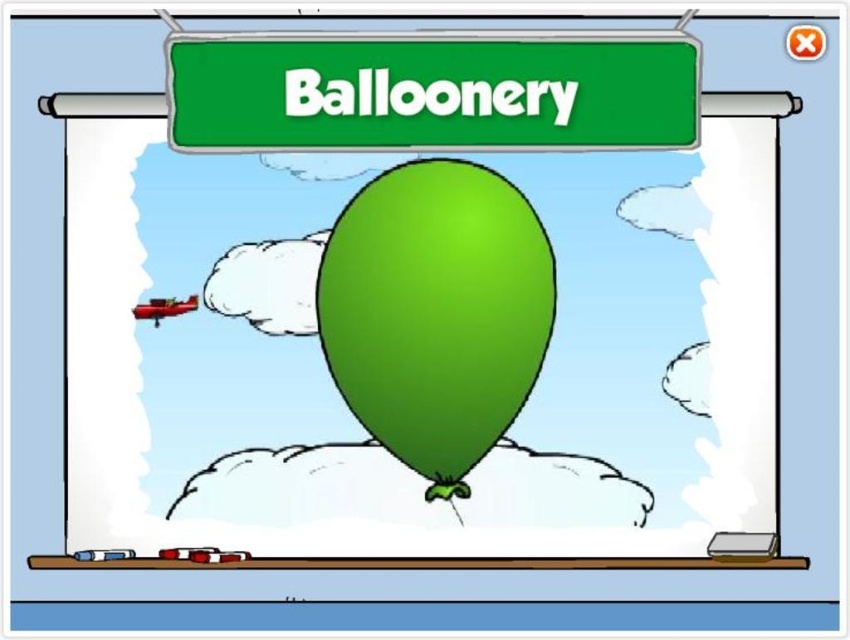
Between green matte signboard at upper center and green rubber balloon at center, which one appears on the left side from the viewer's perspective?

green rubber balloon at center

Is point (459, 72) closer to viewer compared to point (392, 314)?

Yes, it is in front of point (392, 314).

This screenshot has height=640, width=850. In order to click on green matte signboard at upper center in this screenshot , I will do `click(431, 92)`.

Identify the location of green matte signboard at upper center. (431, 92).